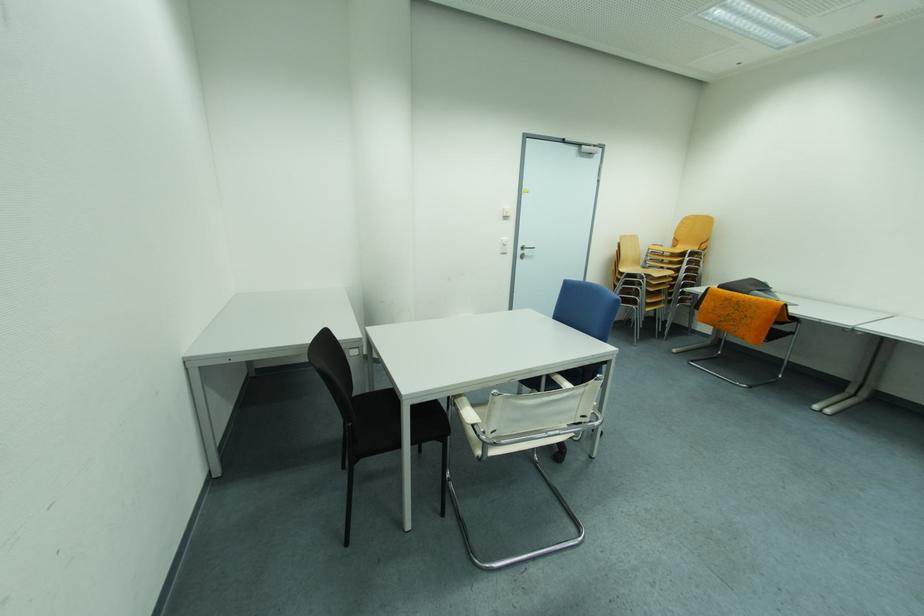
Find where to pull the silver door handle. Please return your answer as a coordinate pair (x, y).

(525, 251)